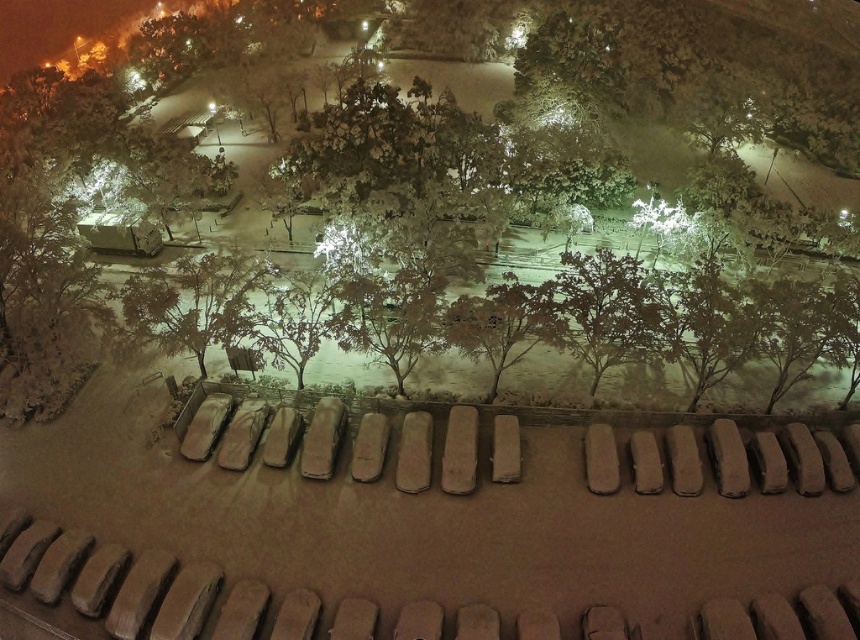
You are standing on an elevated platform overlooking a snow covered parking lot. You see two points marked on the ground, one at coordinate point (142, 330) and the other at point (456, 342). Which point is closer to your current position?

Point (142, 330) is closer to your current position because it is further to the viewer than point (456, 342).

You are standing at the edge of the snow covered parking lot and see the green matte tree at center and the snowy bark tree at center. Which tree appears closer to you?

The green matte tree at center appears closer because it is positioned over the snowy bark tree at center, indicating it is in front.